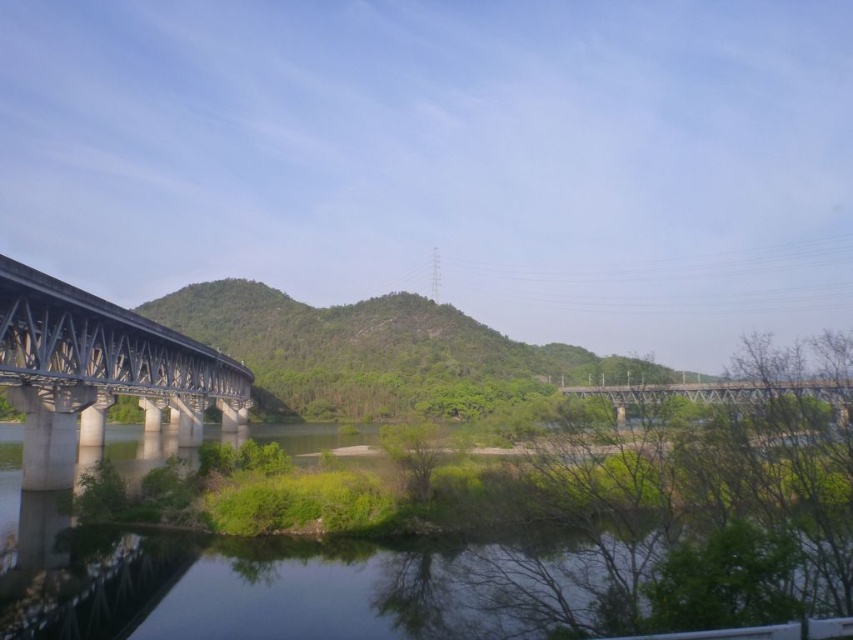
Question: Does clear water at lower left appear on the right side of concrete bridge at left?

Choices:
 (A) no
 (B) yes

Answer: (B)

Question: Which point is closer to the camera taking this photo?

Choices:
 (A) click(x=633, y=392)
 (B) click(x=216, y=556)

Answer: (A)

Question: Does concrete bridge at left appear on the left side of metallic gray bridge at center?

Choices:
 (A) no
 (B) yes

Answer: (B)

Question: Does clear water at lower left appear on the right side of concrete bridge at left?

Choices:
 (A) yes
 (B) no

Answer: (A)

Question: Which of the following is the closest to the observer?

Choices:
 (A) (767, 392)
 (B) (117, 330)

Answer: (A)

Question: Estimate the real-world distances between objects in this image. Which object is farther from the metallic gray bridge at center?

Choices:
 (A) concrete bridge at left
 (B) clear water at lower left

Answer: (A)